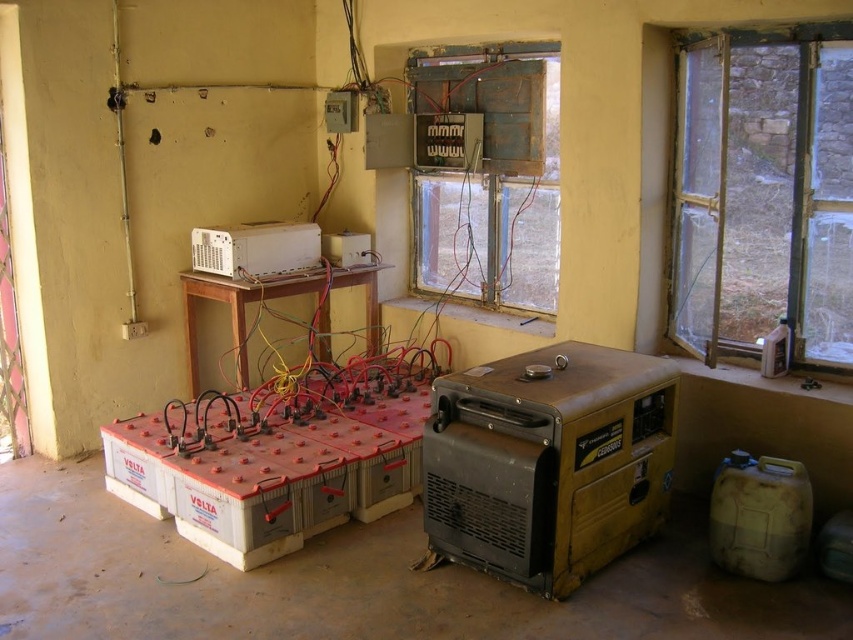
Is wooden frame at center positioned at the back of white plastic microwave at upper center?

No, it is not.

Which is behind, point (555, 154) or point (308, 228)?

The point (308, 228) is behind.

Is point (502, 301) farther from viewer compared to point (219, 275)?

Yes, it is behind point (219, 275).

Where is `wooden frame at center`? wooden frame at center is located at coordinates (491, 177).

Is point (229, 248) positioned in front of point (341, 237)?

Yes, point (229, 248) is in front of point (341, 237).

Can you confirm if white plastic microwave at upper center is thinner than white plastic device at center?

In fact, white plastic microwave at upper center might be wider than white plastic device at center.

Is point (260, 259) positioned in front of point (331, 262)?

Yes, it is in front of point (331, 262).

Locate an element on the screen. The image size is (853, 640). white plastic microwave at upper center is located at coordinates (256, 250).

Describe the element at coordinates (548, 461) in the screenshot. The width and height of the screenshot is (853, 640). I see `yellow metallic generator at center` at that location.

Is point (654, 529) farther from viewer compared to point (415, 260)?

No, it is not.

Describe the element at coordinates (548, 461) in the screenshot. I see `yellow metallic generator at center` at that location.

You are a GUI agent. You are given a task and a screenshot of the screen. Output one action in this format:
    pyautogui.click(x=<x>, y=<y>)
    Task: Click on the yellow metallic generator at center
    
    Given the screenshot: What is the action you would take?
    pyautogui.click(x=548, y=461)